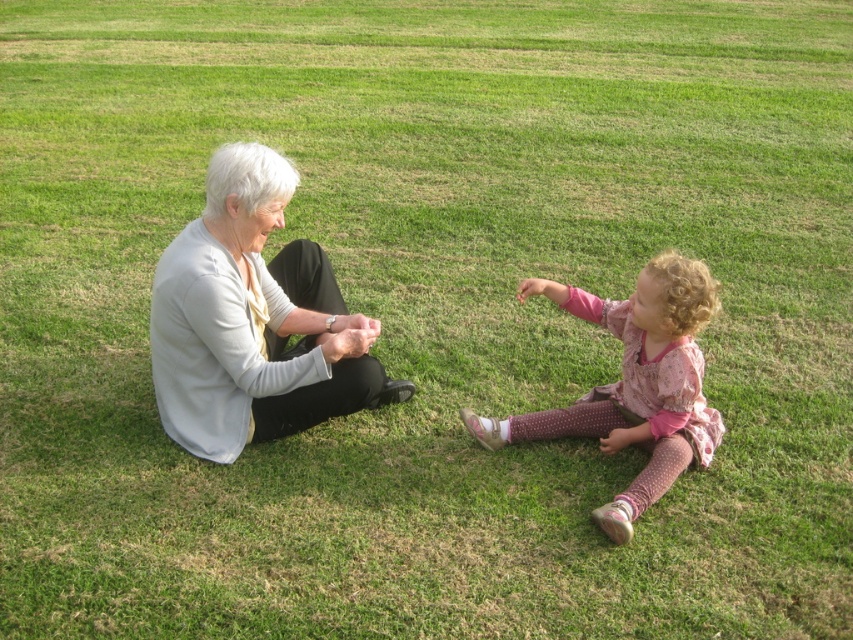
Question: Which object is closer to the camera taking this photo?

Choices:
 (A) white matte sweater at left
 (B) pink dotted fabric at lower right

Answer: (B)

Question: Does white matte sweater at left appear over pink dotted fabric at lower right?

Choices:
 (A) yes
 (B) no

Answer: (A)

Question: Is white matte sweater at left below pink dotted fabric at lower right?

Choices:
 (A) yes
 (B) no

Answer: (B)

Question: Can you confirm if white matte sweater at left is bigger than pink dotted fabric at lower right?

Choices:
 (A) yes
 (B) no

Answer: (A)

Question: Which point is closer to the camera?

Choices:
 (A) (238, 340)
 (B) (653, 496)

Answer: (A)